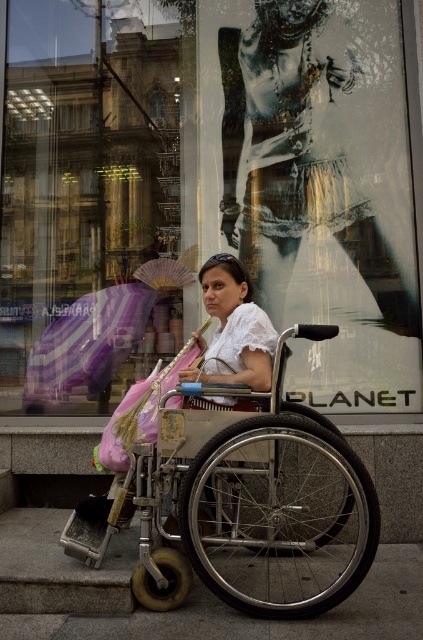
Question: Is matte purple umbrella at left to the right of white lace shirt at center from the viewer's perspective?

Choices:
 (A) no
 (B) yes

Answer: (A)

Question: Does silver metallic wheelchair at center have a greater width compared to gray concrete pavement at lower center?

Choices:
 (A) yes
 (B) no

Answer: (B)

Question: Which point is closer to the camera taking this photo?

Choices:
 (A) (238, 589)
 (B) (302, 129)
 (C) (110, 330)

Answer: (A)

Question: Which is farther from the silver metallic wheelchair at center?

Choices:
 (A) striped fabric umbrella at left
 (B) metallic silver dress at center
 (C) gray concrete pavement at lower center

Answer: (A)

Question: Can you confirm if metallic silver dress at center is thinner than matte purple umbrella at left?

Choices:
 (A) no
 (B) yes

Answer: (A)

Question: Which of these objects is positioned closest to the silver metallic wheelchair at center?

Choices:
 (A) matte purple umbrella at left
 (B) gray concrete pavement at lower center
 (C) metallic silver dress at center

Answer: (B)